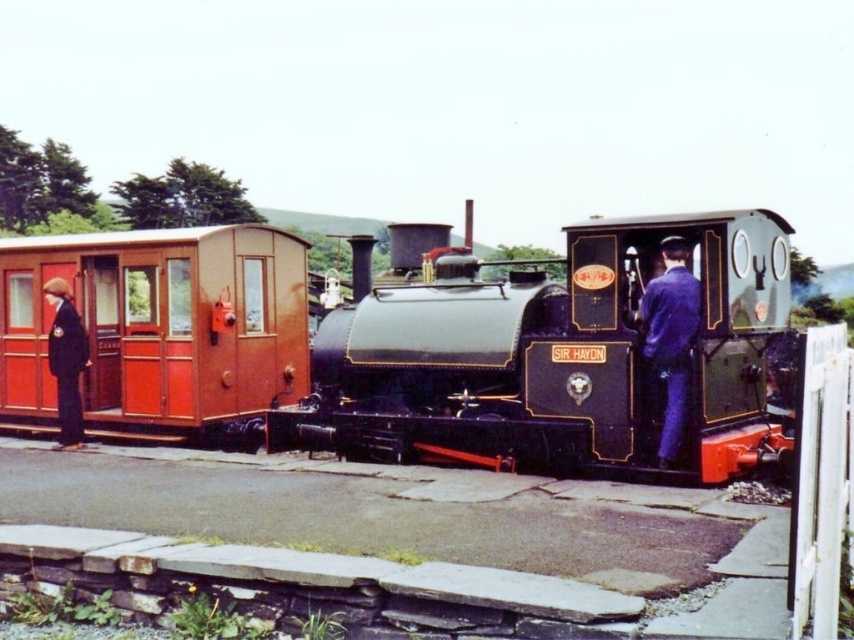
Who is lower down, polished black locomotive at center or blue fabric uniform at center?

blue fabric uniform at center is lower down.

Can you confirm if polished black locomotive at center is positioned below blue fabric uniform at center?

Actually, polished black locomotive at center is above blue fabric uniform at center.

Is point (106, 291) positioned after point (654, 316)?

Yes, point (106, 291) is farther from viewer.

The image size is (854, 640). Identify the location of polished black locomotive at center. (423, 353).

The height and width of the screenshot is (640, 854). Describe the element at coordinates (423, 353) in the screenshot. I see `polished black locomotive at center` at that location.

Can you confirm if polished black locomotive at center is wider than matte red train car at left?

Correct, the width of polished black locomotive at center exceeds that of matte red train car at left.

Between point (452, 326) and point (48, 401), which one is positioned in front?

Point (452, 326) is more forward.

This screenshot has height=640, width=854. Find the location of `polished black locomotive at center`. polished black locomotive at center is located at coordinates (423, 353).

Consider the image. Who is taller, matte red train car at left or blue fabric uniform at center?

blue fabric uniform at center is taller.

Does matte red train car at left appear on the left side of blue fabric uniform at center?

Yes, matte red train car at left is to the left of blue fabric uniform at center.

Is point (180, 436) closer to viewer compared to point (654, 365)?

No, it is not.

Locate an element on the screen. The width and height of the screenshot is (854, 640). matte red train car at left is located at coordinates (158, 326).